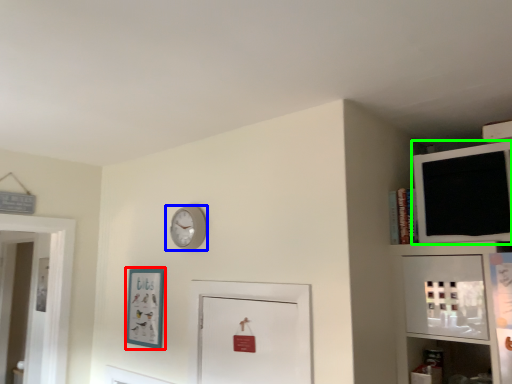
Question: Which object is the closest to the picture frame (highlighted by a red box)? Choose among these: wall clock (highlighted by a blue box) or medicine cabinet (highlighted by a green box).

Choices:
 (A) wall clock
 (B) medicine cabinet

Answer: (A)